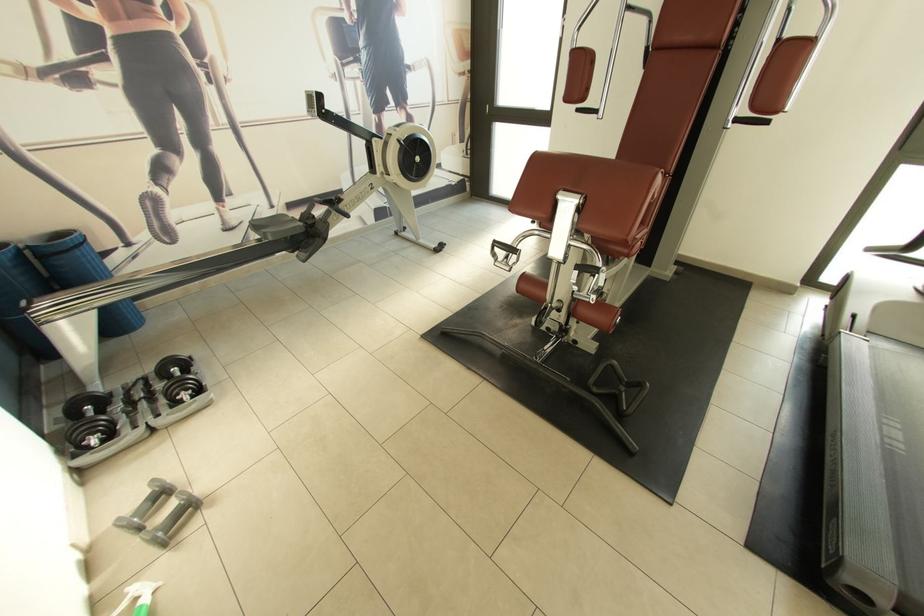
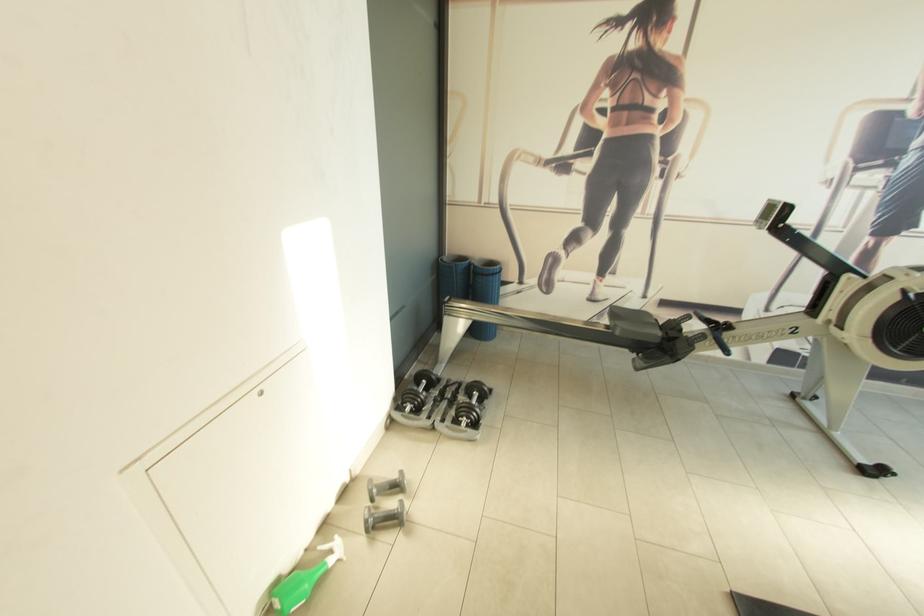
Where in the second image is the point corresponding to (152,493) from the first image?

(398, 477)